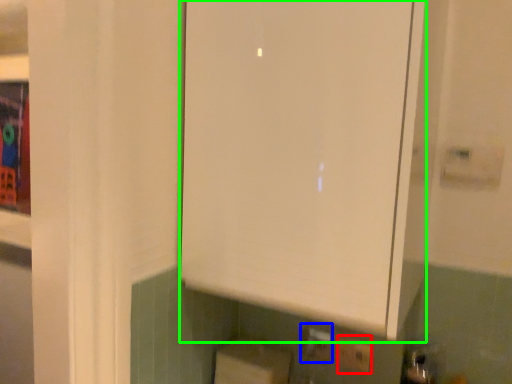
Question: Which is farther away from electric outlet (highlighted by a red box)? electric outlet (highlighted by a blue box) or cabinetry (highlighted by a green box)?

Choices:
 (A) electric outlet
 (B) cabinetry

Answer: (B)